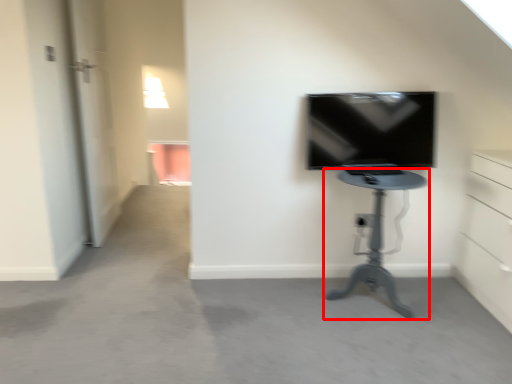
Question: In this image, where is furniture (annotated by the red box) located relative to television?

Choices:
 (A) left
 (B) right

Answer: (B)